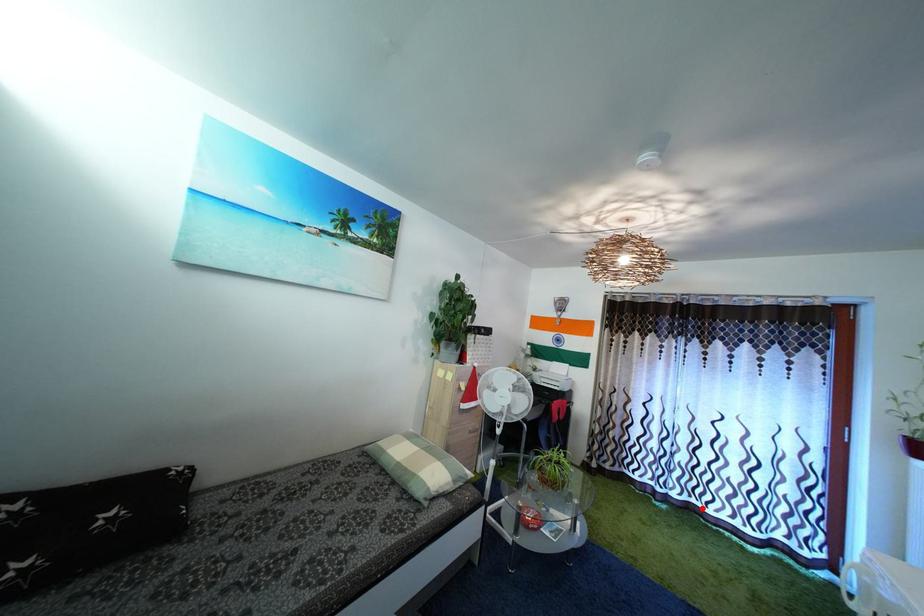
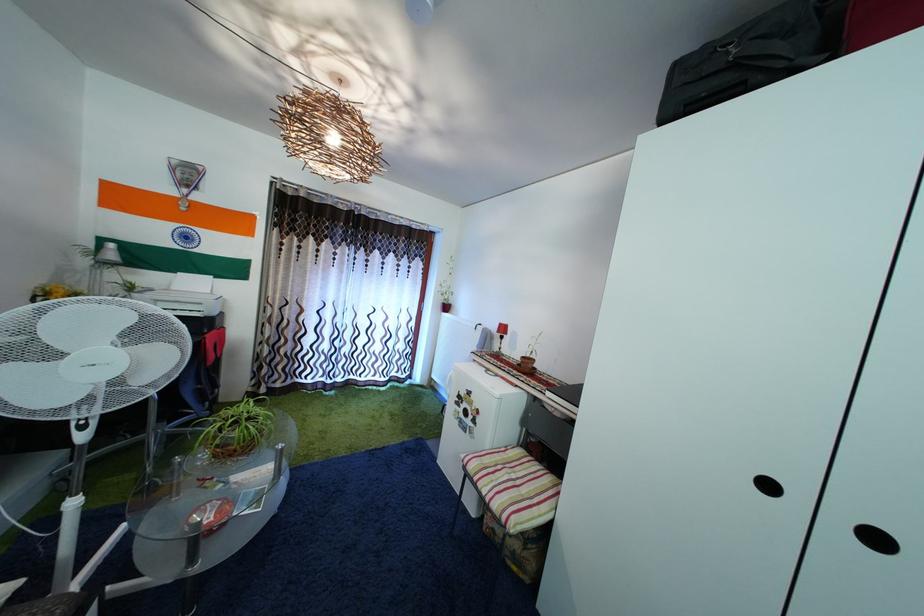
Where in the second image is the point corresponding to the highlighted location from the first image?

(359, 384)